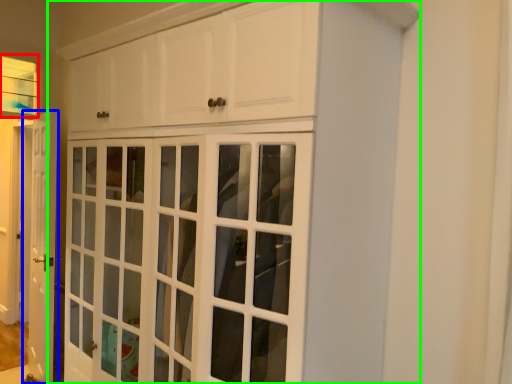
Question: Estimate the real-world distances between objects in this image. Which object is closer to window (highlighted by a red box), door (highlighted by a blue box) or cupboard (highlighted by a green box)?

Choices:
 (A) door
 (B) cupboard

Answer: (A)